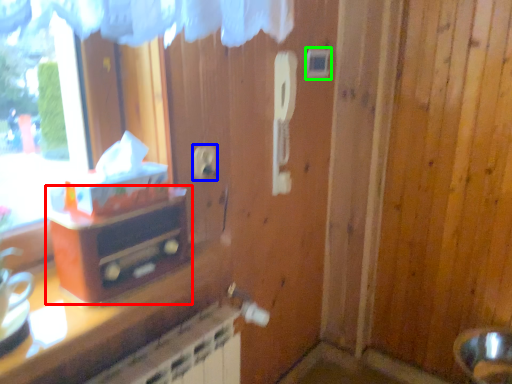
Question: Based on their relative distances, which object is nearer to furniture (highlighted by a red box)? Choose from electric outlet (highlighted by a blue box) and light switch (highlighted by a green box).

Choices:
 (A) electric outlet
 (B) light switch

Answer: (A)